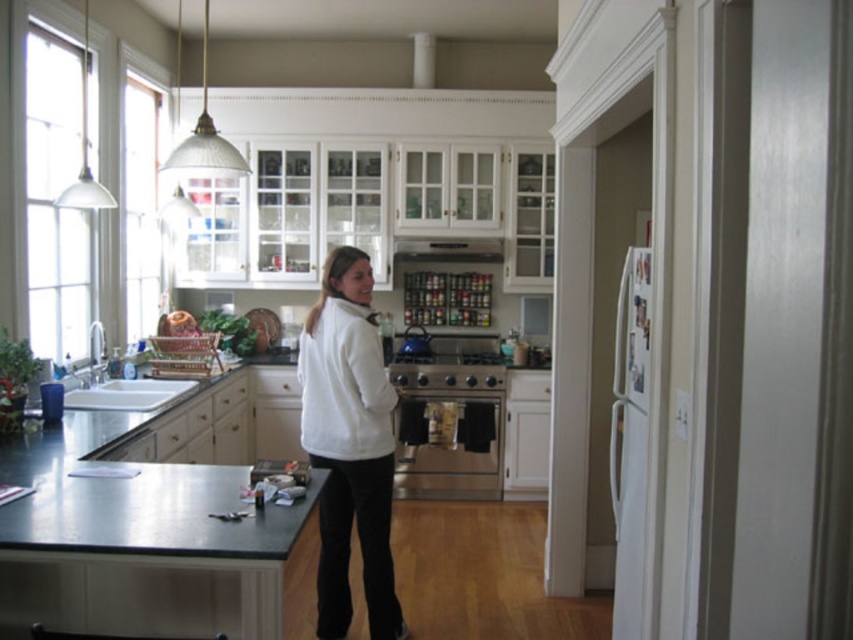
Question: Does white matte refrigerator at right appear on the left side of satin silver metal exhaust hood at upper center?

Choices:
 (A) yes
 (B) no

Answer: (B)

Question: Which object is positioned closest to the satin silver oven at center?

Choices:
 (A) white matte refrigerator at right
 (B) white fleece sweatshirt at center
 (C) white fleece sweater at center
 (D) satin silver metal exhaust hood at upper center

Answer: (D)

Question: Which point is farther to the camera?

Choices:
 (A) white fleece sweater at center
 (B) satin silver oven at center
 (C) white matte refrigerator at right
 (D) satin silver metal exhaust hood at upper center

Answer: (D)

Question: Which point appears farthest from the camera in this image?

Choices:
 (A) (350, 317)
 (B) (395, 259)
 (C) (410, 397)
 (D) (634, 522)

Answer: (B)

Question: Is the position of white fleece sweater at center less distant than that of white matte refrigerator at right?

Choices:
 (A) yes
 (B) no

Answer: (B)

Question: Does white fleece sweater at center come in front of white matte refrigerator at right?

Choices:
 (A) no
 (B) yes

Answer: (A)